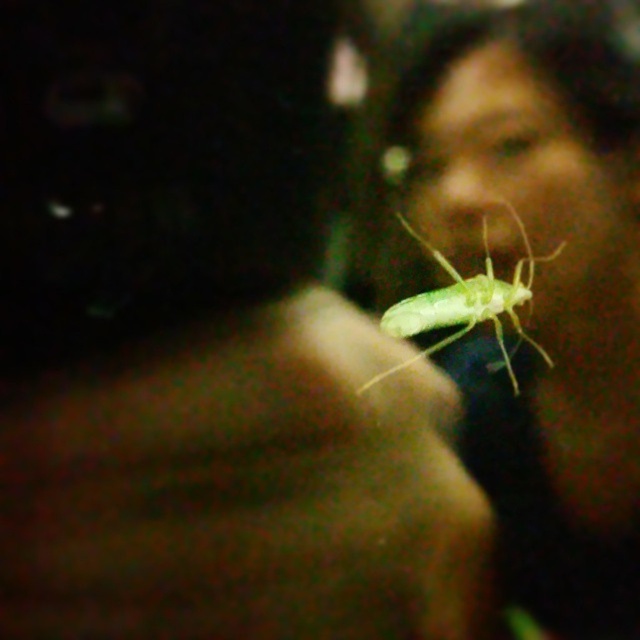
Does green translucent insect at upper right have a greater height compared to green translucent insect at center?

Yes.

Does green translucent insect at upper right appear on the right side of green translucent insect at center?

Correct, you'll find green translucent insect at upper right to the right of green translucent insect at center.

Is point (621, 246) positioned before point (358, 392)?

Yes, point (621, 246) is in front of point (358, 392).

Image resolution: width=640 pixels, height=640 pixels. Identify the location of green translucent insect at upper right. (541, 285).